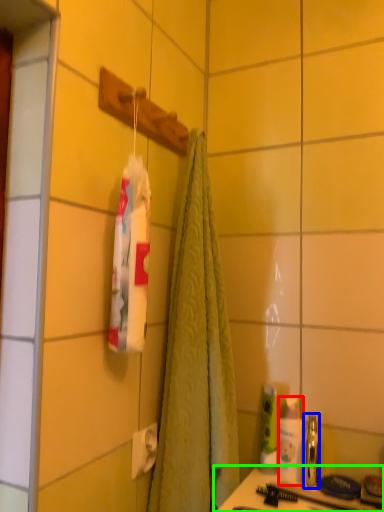
Question: Considering the real-world distances, which object is closest to toiletry (highlighted by a red box)? mouthwash (highlighted by a blue box) or counter (highlighted by a green box).

Choices:
 (A) mouthwash
 (B) counter

Answer: (A)